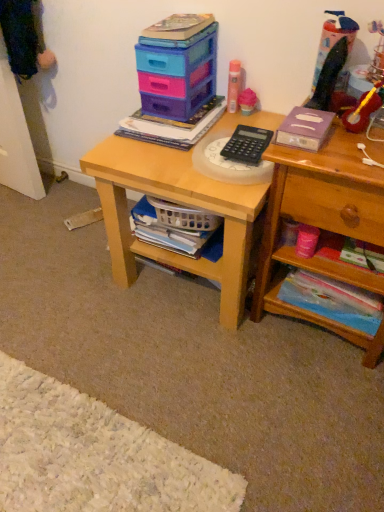
You are a GUI agent. You are given a task and a screenshot of the screen. Output one action in this format:
    pyautogui.click(x=<x>, y=<y>)
    Task: Click on the free spot above matte plastic book at center, which is the 1th book in top-to-bottom order (from a real-world perspective)
    The height and width of the screenshot is (512, 384).
    Given the screenshot: What is the action you would take?
    pyautogui.click(x=161, y=116)